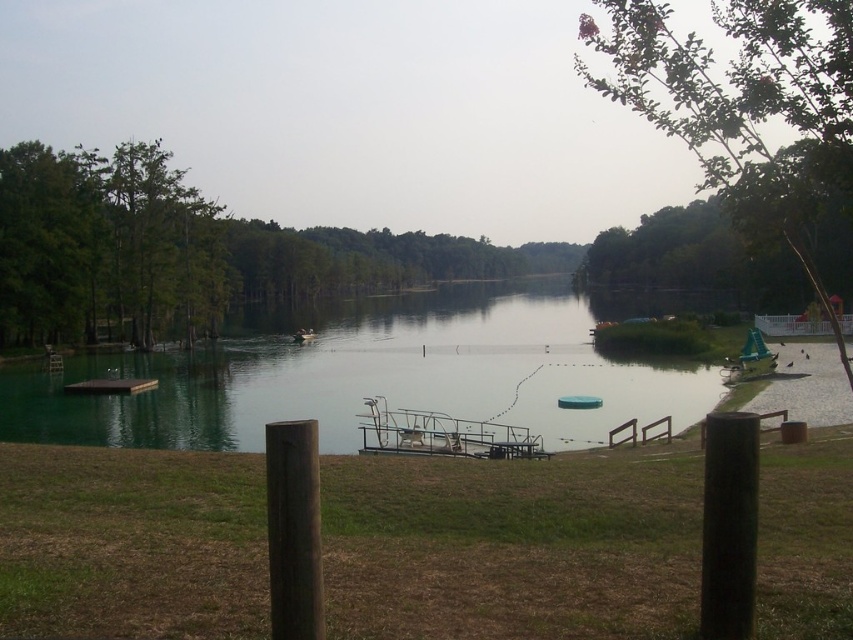
You are standing on the shore of the lake and want to board the green plastic boat at right. Which direction should you walk to reach it from the metallic gray dock at center?

The metallic gray dock at center is positioned under the green plastic boat at right, so you should walk towards the right from the metallic gray dock at center to reach the green plastic boat at right.

You are a boat operator who needs to navigate a green plastic boat at right to the metallic gray dock at center. Given that the boat can travel at a speed of 10 feet per second, how many seconds will it take to reach the dock?

The metallic gray dock at center is 88.91 feet from the green plastic boat at right. At a speed of 10 feet per second, the boat will take approximately 8.89 seconds to reach the dock.

You are standing on the lakeside and want to locate the green water at center. According to the coordinates provided, where exactly should you look?

The green water at center is located at coordinates point (x=373, y=372).